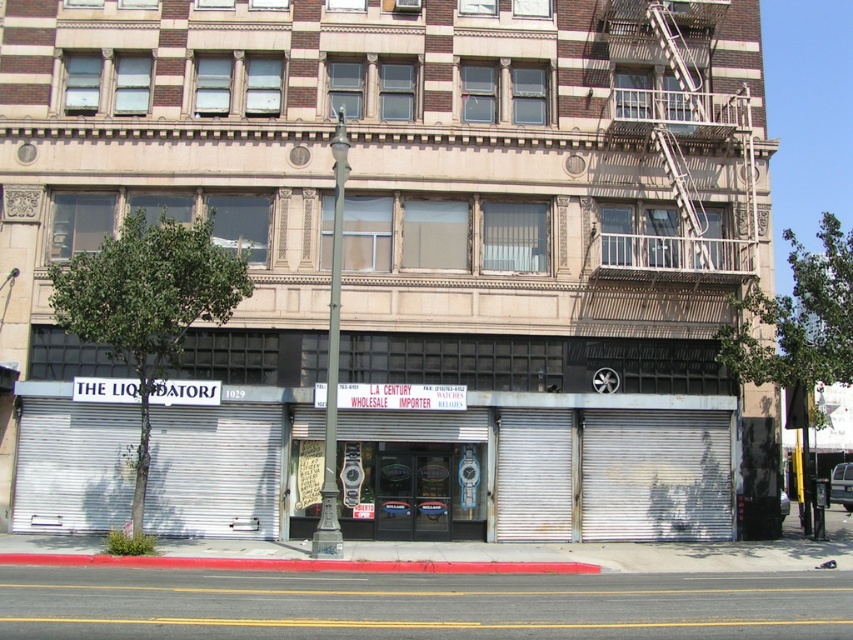
Question: Observing the image, what is the correct spatial positioning of silver metallic shutters at center in reference to metallic fire escape at upper right?

Choices:
 (A) left
 (B) right

Answer: (A)

Question: Which object is farther from the camera taking this photo?

Choices:
 (A) metallic fire escape at upper right
 (B) silver metallic shutters at center

Answer: (A)

Question: Can you confirm if silver metallic shutters at center is positioned to the left of metallic fire escape at upper right?

Choices:
 (A) no
 (B) yes

Answer: (B)

Question: Does silver metallic shutters at center appear under metallic fire escape at upper right?

Choices:
 (A) yes
 (B) no

Answer: (A)

Question: Which point is farther to the camera?

Choices:
 (A) metallic fire escape at upper right
 (B) silver metallic shutters at center

Answer: (A)